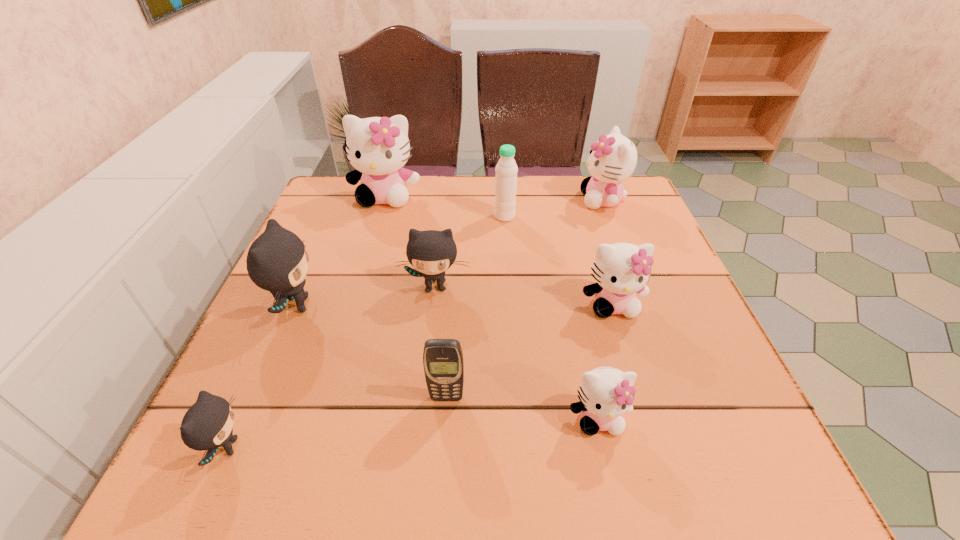
Identify the location of the biggest white kitten. (377, 147).

Image resolution: width=960 pixels, height=540 pixels. In order to click on the tallest kitten in this screenshot , I will do `click(377, 147)`.

Where is `the second biggest white kitten`? This screenshot has width=960, height=540. the second biggest white kitten is located at coordinates (613, 158).

You are a GUI agent. You are given a task and a screenshot of the screen. Output one action in this format:
    pyautogui.click(x=<x>, y=<y>)
    Task: Click on the fourth object from right to left
    Image resolution: width=960 pixels, height=540 pixels.
    Given the screenshot: What is the action you would take?
    (506, 169)

Locate an element on the screen. The height and width of the screenshot is (540, 960). water bottle is located at coordinates (506, 169).

Where is `the biggest gray kitten`? This screenshot has height=540, width=960. the biggest gray kitten is located at coordinates (277, 261).

What are the coordinates of `the third farthest white kitten` in the screenshot? It's located at (621, 270).

Find the location of a particular element. The image size is (960, 540). the rightmost gray kitten is located at coordinates (431, 252).

I want to click on gray cellular telephone, so [443, 363].

What are the coordinates of `the nearest white kitten` in the screenshot? It's located at (606, 393).